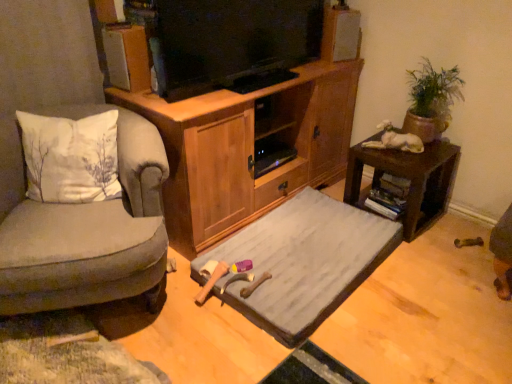
Question: Is white cotton pillow at left turned away from velvet grey armchair at left?

Choices:
 (A) no
 (B) yes

Answer: (B)

Question: Is white cotton pillow at left far from velvet grey armchair at left?

Choices:
 (A) yes
 (B) no

Answer: (B)

Question: Is white cotton pillow at left placed right next to velvet grey armchair at left?

Choices:
 (A) no
 (B) yes

Answer: (A)

Question: Does white cotton pillow at left have a larger size compared to velvet grey armchair at left?

Choices:
 (A) no
 (B) yes

Answer: (A)

Question: Does white cotton pillow at left lie behind velvet grey armchair at left?

Choices:
 (A) yes
 (B) no

Answer: (A)

Question: Is white cotton pillow at left situated inside velvet grey armchair at left or outside?

Choices:
 (A) outside
 (B) inside

Answer: (B)

Question: Considering the positions of point (31, 157) and point (150, 274), is point (31, 157) closer or farther from the camera than point (150, 274)?

Choices:
 (A) farther
 (B) closer

Answer: (A)

Question: Is white cotton pillow at left in front of or behind velvet grey armchair at left in the image?

Choices:
 (A) front
 (B) behind

Answer: (B)

Question: From a real-world perspective, is white cotton pillow at left above or below velvet grey armchair at left?

Choices:
 (A) above
 (B) below

Answer: (A)

Question: Is velvet grey armchair at left bigger or smaller than green clay pot at upper right?

Choices:
 (A) small
 (B) big

Answer: (B)

Question: Is point (91, 261) positioned closer to the camera than point (415, 114)?

Choices:
 (A) farther
 (B) closer

Answer: (B)

Question: From a real-world perspective, is velvet grey armchair at left physically located above or below green clay pot at upper right?

Choices:
 (A) above
 (B) below

Answer: (B)

Question: Is velvet grey armchair at left to the left or to the right of green clay pot at upper right in the image?

Choices:
 (A) right
 (B) left

Answer: (B)

Question: From the image's perspective, relative to gray fabric bed at center, is white cotton pillow at left above or below?

Choices:
 (A) above
 (B) below

Answer: (A)

Question: In the image, is white cotton pillow at left on the left side or the right side of gray fabric bed at center?

Choices:
 (A) right
 (B) left

Answer: (B)